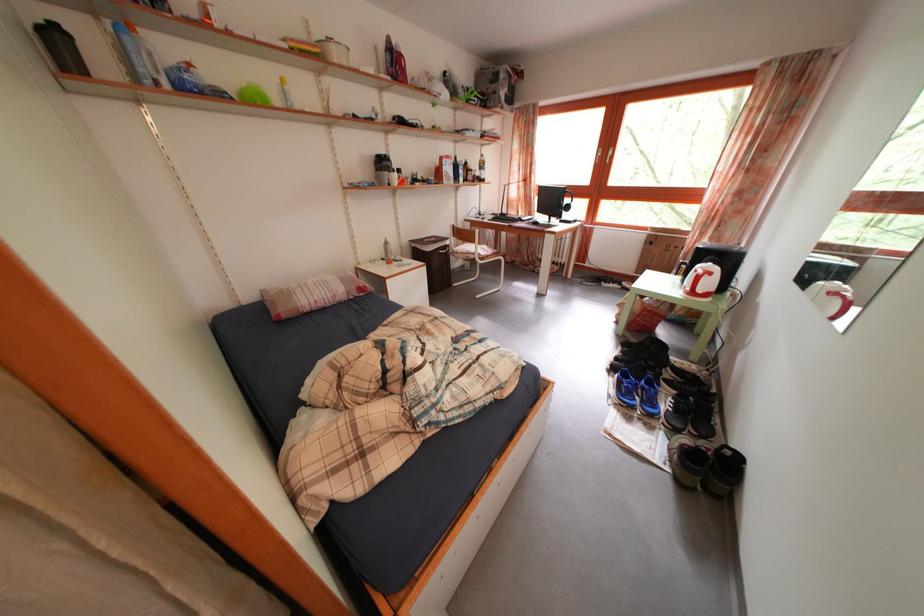
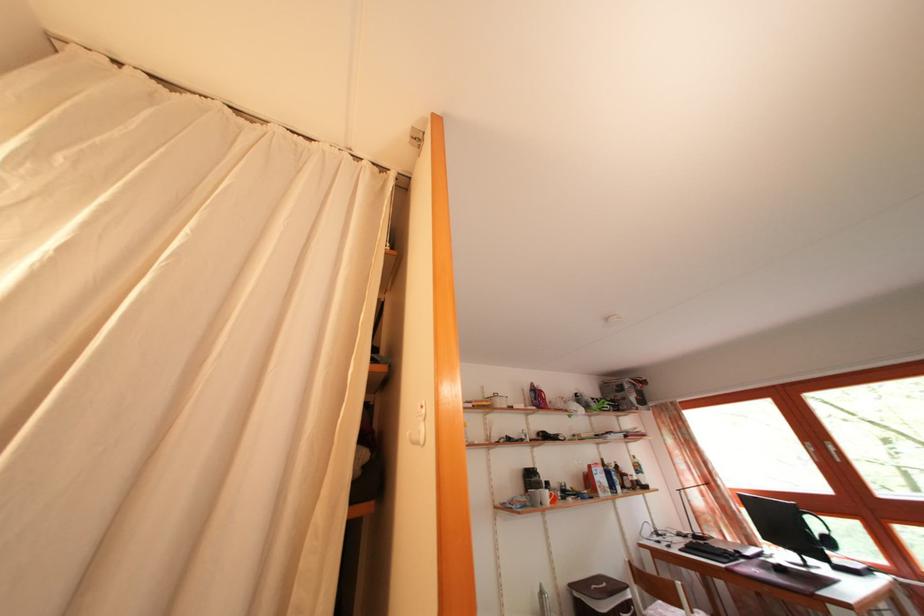
Find the pixel in the second image that matches the point at 576,215 in the first image.

(837, 549)